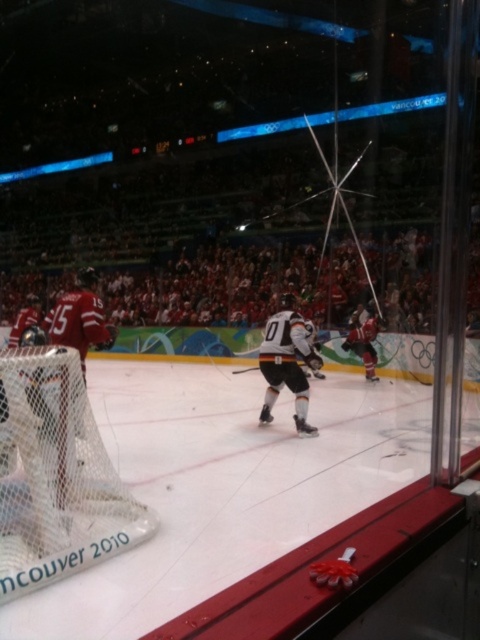
You are a photographer standing behind the goal net at the Vancouver 2010 Winter Olympics hockey game. You want to take a photo that includes both the matte red jersey at right and the black matte hockey stick at center. Based on their sizes in the image, which object should you zoom in on to ensure both are clearly visible in the frame?

The matte red jersey at right is much taller than the black matte hockey stick at center, so you should zoom in on the matte red jersey at right to ensure both objects are clearly visible in the frame.

You are a photographer standing behind the goal net on the left side of the ice rink. You want to take a photo of the matte red jersey at right. Based on the coordinates provided, where should you aim your camera relative to the center of the image?

The matte red jersey at right is located at coordinates point (363,342), which means it is positioned slightly to the right and above the center of the image. To capture it, aim your camera slightly to the right and upwards from the center.